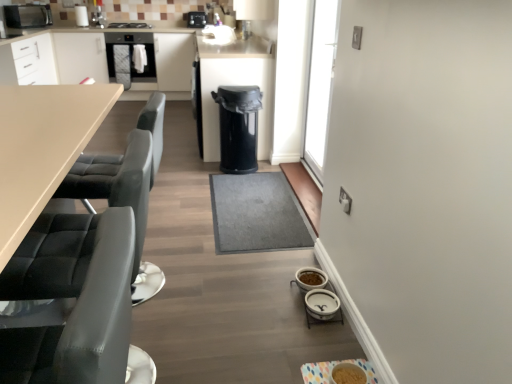
What do you see at coordinates (320, 83) in the screenshot? This screenshot has width=512, height=384. I see `transparent glass door at upper right` at bounding box center [320, 83].

Measure the distance between matte plastic bowl at lower center, which ranks as the 1th appliance in bottom-to-top order, and camera.

matte plastic bowl at lower center, which ranks as the 1th appliance in bottom-to-top order, is 5.20 feet from camera.

Image resolution: width=512 pixels, height=384 pixels. In order to click on matte plastic bowl at lower center, the seventh appliance positioned from the top in this screenshot , I will do `click(331, 369)`.

Locate an element on the screen. This screenshot has width=512, height=384. white ceramic bowls at lower right, acting as the 4th appliance starting from the back is located at coordinates (310, 278).

What do you see at coordinates (310, 278) in the screenshot? I see `white ceramic bowls at lower right, acting as the fourth appliance starting from the bottom` at bounding box center [310, 278].

Locate an element on the screen. The width and height of the screenshot is (512, 384). white matte cabinetry at upper left is located at coordinates (55, 57).

Measure the distance between white ceramic bowls at lower center, placed as the fifth appliance when sorted from back to front, and camera.

They are 6.13 feet apart.

This screenshot has width=512, height=384. I want to click on matte black oven at upper left, so click(x=128, y=56).

Where is `transparent glass door at upper right`? The height and width of the screenshot is (384, 512). transparent glass door at upper right is located at coordinates (320, 83).

Considering their positions, is white ceramic bowls at lower right, acting as the 4th appliance starting from the back, located in front of or behind matte plastic bowl at lower center, the 1th appliance viewed from the right?

Clearly, white ceramic bowls at lower right, acting as the 4th appliance starting from the back, is behind matte plastic bowl at lower center, the 1th appliance viewed from the right.

Considering the relative sizes of white ceramic bowls at lower right, which is the fourth appliance in top-to-bottom order, and matte plastic bowl at lower center, the seventh appliance positioned from the top, in the image provided, is white ceramic bowls at lower right, which is the fourth appliance in top-to-bottom order, thinner than matte plastic bowl at lower center, the seventh appliance positioned from the top,?

Correct, the width of white ceramic bowls at lower right, which is the fourth appliance in top-to-bottom order, is less than that of matte plastic bowl at lower center, the seventh appliance positioned from the top.

Is point (317, 281) closer or farther from the camera than point (308, 380)?

Point (317, 281) is farther from the camera than point (308, 380).

Which of these two, white ceramic bowls at lower right, acting as the 4th appliance starting from the back, or matte plastic bowl at lower center, which ranks as the 1th appliance in bottom-to-top order, stands taller?

With more height is white ceramic bowls at lower right, acting as the 4th appliance starting from the back.

Does black matte stove at upper center have a greater height compared to gray carpet at center?

Yes, black matte stove at upper center is taller than gray carpet at center.

Is black matte stove at upper center positioned with its back to gray carpet at center?

No.

Would you say black matte stove at upper center is outside gray carpet at center?

Indeed, black matte stove at upper center is completely outside gray carpet at center.

Between black matte stove at upper center and gray carpet at center, which one appears on the left side from the viewer's perspective?

black matte stove at upper center.

Considering the positions of points (170, 49) and (145, 77), is point (170, 49) farther from camera compared to point (145, 77)?

That is False.

What's the angular difference between white matte cabinetry at upper left and matte black oven at upper left's facing directions?

There is a 0.0126-degree angle between the facing directions of white matte cabinetry at upper left and matte black oven at upper left.

Does white matte cabinetry at upper left turn towards matte black oven at upper left?

Yes, white matte cabinetry at upper left is oriented towards matte black oven at upper left.

Between white matte cabinetry at upper left and matte black oven at upper left, which one has less height?

matte black oven at upper left is shorter.

Does white ceramic bowls at lower center, which appears as the 3th appliance when viewed from the front, have a lesser height compared to gray carpet at center?

Incorrect, the height of white ceramic bowls at lower center, which appears as the 3th appliance when viewed from the front, does not fall short of that of gray carpet at center.

Is white ceramic bowls at lower center, the 2th appliance when ordered from right to left, inside or outside of gray carpet at center?

white ceramic bowls at lower center, the 2th appliance when ordered from right to left, is not enclosed by gray carpet at center.

Considering the sizes of objects transparent glass door at upper right and white ceramic bowls at lower center, which appears as the 3th appliance when viewed from the front, in the image provided, who is wider, transparent glass door at upper right or white ceramic bowls at lower center, which appears as the 3th appliance when viewed from the front,?

Wider between the two is white ceramic bowls at lower center, which appears as the 3th appliance when viewed from the front.

From a real-world perspective, between transparent glass door at upper right and white ceramic bowls at lower center, which appears as the 3th appliance when viewed from the front, who is vertically lower?

In real-world perspective, white ceramic bowls at lower center, which appears as the 3th appliance when viewed from the front, is lower.

Is transparent glass door at upper right not inside white ceramic bowls at lower center, placed as the fifth appliance when sorted from back to front?

Indeed, transparent glass door at upper right is completely outside white ceramic bowls at lower center, placed as the fifth appliance when sorted from back to front.

How many degrees apart are the facing directions of transparent glass door at upper right and white ceramic bowls at lower center, which appears as the fifth appliance when viewed from the top?

The angle between the facing direction of transparent glass door at upper right and the facing direction of white ceramic bowls at lower center, which appears as the fifth appliance when viewed from the top, is 1.62 degrees.

From the image's perspective, is transparent glass door at upper right below gray carpet at center?

No.

In terms of width, does transparent glass door at upper right look wider or thinner when compared to gray carpet at center?

In the image, transparent glass door at upper right appears to be more narrow than gray carpet at center.

Which is behind, transparent glass door at upper right or gray carpet at center?

transparent glass door at upper right is more distant.

Does black matte stove at upper center have a lesser width compared to matte black oven at upper left?

Correct, the width of black matte stove at upper center is less than that of matte black oven at upper left.

Would you consider black matte stove at upper center to be distant from matte black oven at upper left?

That's not correct — black matte stove at upper center is a little close to matte black oven at upper left.

Which object is further away from the camera, black matte stove at upper center or matte black oven at upper left?

black matte stove at upper center is behind.

Is black matte stove at upper center facing away from matte black oven at upper left?

That's not correct — black matte stove at upper center is not looking away from matte black oven at upper left.

Locate an element on the screen. Image resolution: width=512 pixels, height=384 pixels. the 3rd appliance in front of the white ceramic bowls at lower right, positioned as the 4th appliance in front-to-back order, starting your count from the anchor is located at coordinates (331, 369).

I want to click on stove lying behind the gray carpet at center, so [x=130, y=25].

When comparing their distances from white ceramic bowls at lower right, the 5th appliance when ordered from left to right, does black plastic trash can at center, placed as the third appliance when sorted from top to bottom, or white matte cabinetry at upper left seem further?

white matte cabinetry at upper left is positioned further to the anchor white ceramic bowls at lower right, the 5th appliance when ordered from left to right.

Consider the image. Which object lies further to the anchor point white ceramic bowls at lower right, the 5th appliance when ordered from left to right, black matte stove at upper center or black matte microwave at upper left, which is the sixth appliance from bottom to top?

black matte microwave at upper left, which is the sixth appliance from bottom to top, is further to white ceramic bowls at lower right, the 5th appliance when ordered from left to right.

Looking at the image, which one is located closer to matte black oven at upper left, white ceramic bowls at lower center, which is counted as the 6th appliance, starting from the left, or black matte microwave at upper left, which is the 2th appliance in back-to-front order?

The object closer to matte black oven at upper left is black matte microwave at upper left, which is the 2th appliance in back-to-front order.

Estimate the real-world distances between objects in this image. Which object is further from white ceramic bowls at lower right, positioned as the 4th appliance in front-to-back order, black matte microwave at upper left, which is the 1th appliance in left-to-right order, or black leather swivel chair at left?

The object further to white ceramic bowls at lower right, positioned as the 4th appliance in front-to-back order, is black matte microwave at upper left, which is the 1th appliance in left-to-right order.

From the image, which object appears to be nearer to white ceramic bowls at lower center, the third appliance ordered from the bottom, gray carpet at center or matte plastic bowl at lower center, the first appliance positioned from the front?

matte plastic bowl at lower center, the first appliance positioned from the front, is closer to white ceramic bowls at lower center, the third appliance ordered from the bottom.

Based on their spatial positions, is black matte stove at upper center or black matte microwave at upper left, which is the sixth appliance from front to back, closer to black plastic camera at upper center, which ranks as the seventh appliance in front-to-back order?

The object closer to black plastic camera at upper center, which ranks as the seventh appliance in front-to-back order, is black matte stove at upper center.

Looking at this image, when comparing their distances from gray carpet at center, does black matte stove at upper center or white ceramic bowls at lower center, placed as the fifth appliance when sorted from back to front, seem further?

The object further to gray carpet at center is black matte stove at upper center.

Considering their positions, is matte black oven at upper left positioned closer to black matte microwave at upper left, which is the sixth appliance from bottom to top, than transparent glass door at upper right?

Among the two, matte black oven at upper left is located nearer to black matte microwave at upper left, which is the sixth appliance from bottom to top.

You are a GUI agent. You are given a task and a screenshot of the screen. Output one action in this format:
    pyautogui.click(x=<x>, y=<y>)
    Task: Click on the cabinetry positioned between black plastic trash can at center, the 5th appliance positioned from the right, and black plastic camera at upper center, which ranks as the seventh appliance in front-to-back order, from near to far
    Image resolution: width=512 pixels, height=384 pixels.
    Given the screenshot: What is the action you would take?
    pyautogui.click(x=55, y=57)

Locate an element on the screen. cabinetry located between white ceramic bowls at lower center, which appears as the fifth appliance when viewed from the top, and black plastic camera at upper center, the 1th appliance in the back-to-front sequence, in the depth direction is located at coordinates coord(55,57).

Image resolution: width=512 pixels, height=384 pixels. Find the location of `glass door between white ceramic bowls at lower right, which is the fourth appliance in top-to-bottom order, and matte black oven at upper left, along the z-axis`. glass door between white ceramic bowls at lower right, which is the fourth appliance in top-to-bottom order, and matte black oven at upper left, along the z-axis is located at coordinates (320, 83).

Where is `plain between white ceramic bowls at lower right, the 6th appliance in the top-to-bottom sequence, and matte black oven at upper left from front to back`? This screenshot has width=512, height=384. plain between white ceramic bowls at lower right, the 6th appliance in the top-to-bottom sequence, and matte black oven at upper left from front to back is located at coordinates (256, 213).